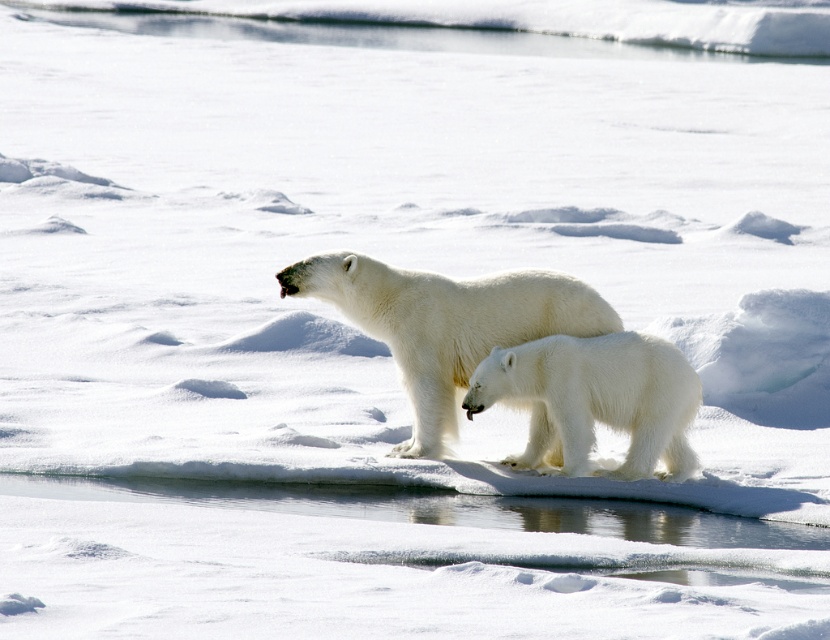
You are a wildlife photographer trying to capture both polar bears in a single shot. Since your camera has a limited focus range, you need to know which bear is higher in the frame. Which polar bear is positioned higher between the white fur polar bear at center and the white fluffy polar bear at center?

The white fur polar bear at center is positioned higher than the white fluffy polar bear at center, so it will be higher in the frame.